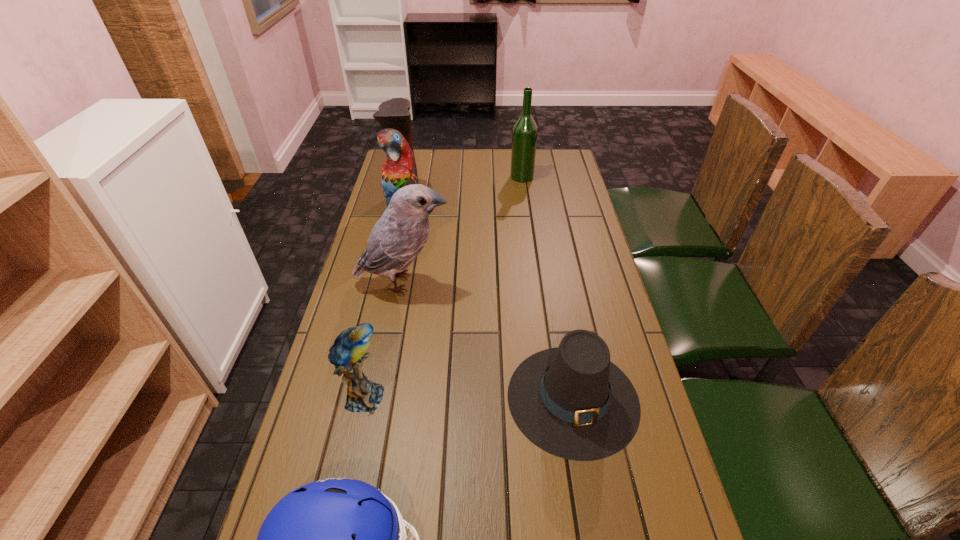
Where is `vacant area that lies between the hat and the fifth nearest object`? This screenshot has height=540, width=960. vacant area that lies between the hat and the fifth nearest object is located at coordinates (489, 302).

What are the coordinates of `free space between the alcohol and the shortest parrot` in the screenshot? It's located at (443, 287).

Find the location of a particular element. vacant space in between the alcohol and the farthest parrot is located at coordinates tap(463, 192).

You are a GUI agent. You are given a task and a screenshot of the screen. Output one action in this format:
    pyautogui.click(x=<x>, y=<y>)
    Task: Click on the free space between the second nearest parrot and the nearest parrot
    
    Given the screenshot: What is the action you would take?
    (384, 340)

Select which object is the second closest to the football helmet. Please provide its 2D coordinates. Your answer should be formatted as a tuple, i.e. [(x, y)], where the tuple contains the x and y coordinates of a point satisfying the conditions above.

[(347, 354)]

What are the coordinates of `object that ranks as the fifth closest to the shortest object` in the screenshot? It's located at click(524, 136).

Identify the location of the second closest parrot to the nearest parrot. (399, 170).

Locate which parrot ranks second in proximity to the shortest object. Please provide its 2D coordinates. Your answer should be formatted as a tuple, i.e. [(x, y)], where the tuple contains the x and y coordinates of a point satisfying the conditions above.

[(347, 354)]